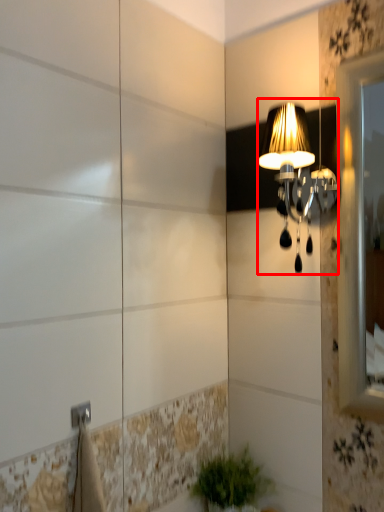
Question: From the image's perspective, where is lamp (annotated by the red box) located in relation to houseplant in the image?

Choices:
 (A) above
 (B) below

Answer: (A)